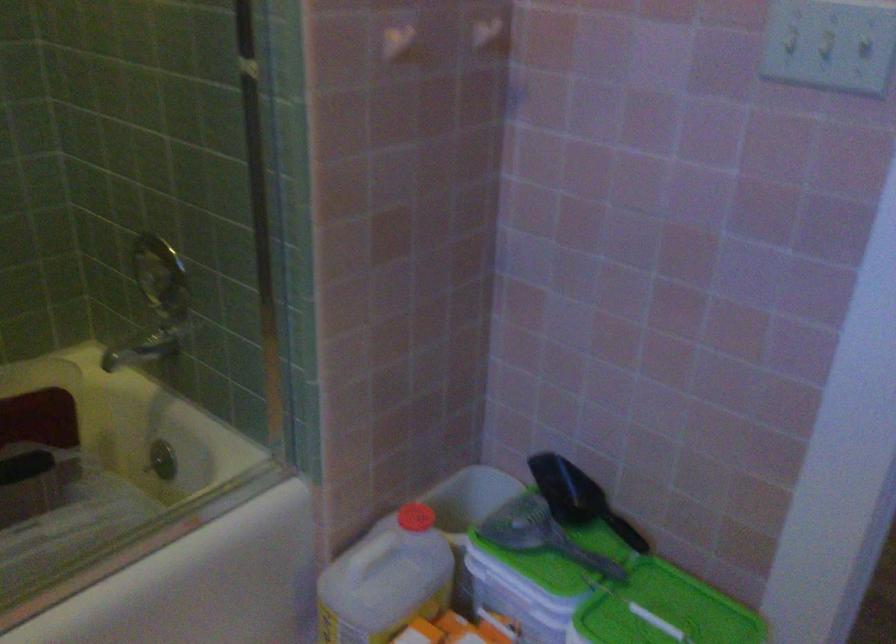
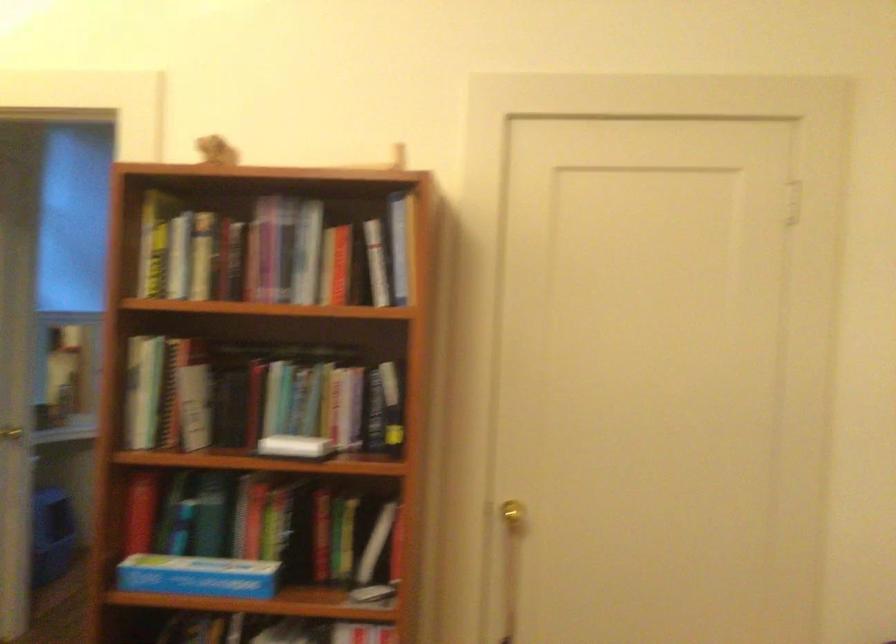
Question: I am providing you with two images of the same scene from different viewpoints. After the viewpoint changes to image2, which objects are now occluded?

Choices:
 (A) gold door knob
 (B) white wall hook
 (C) bicycle handlebars
 (D) blue cardboard box

Answer: (B)